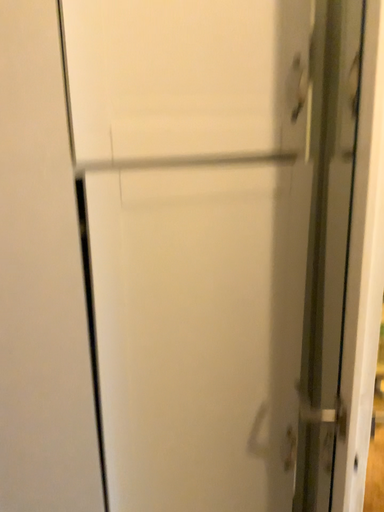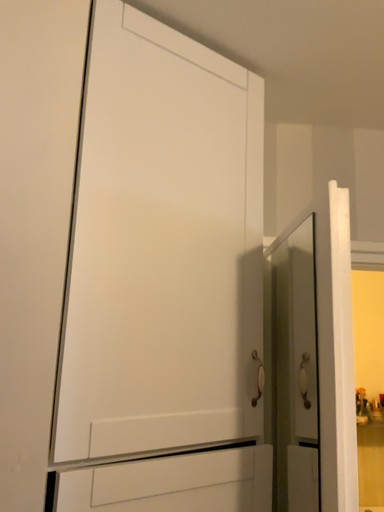
Question: Which way did the camera rotate in the video?

Choices:
 (A) rotated downward
 (B) rotated upward

Answer: (B)